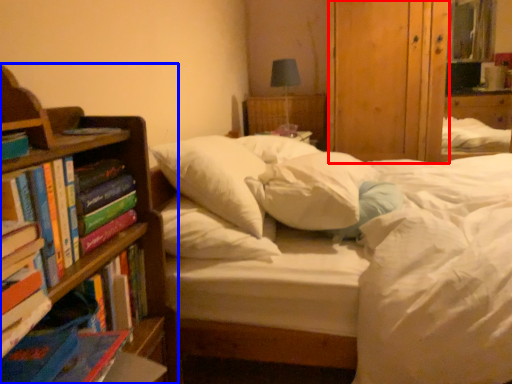
Question: Among these objects, which one is nearest to the camera, armoire (highlighted by a red box) or bookcase (highlighted by a blue box)?

Choices:
 (A) armoire
 (B) bookcase

Answer: (B)